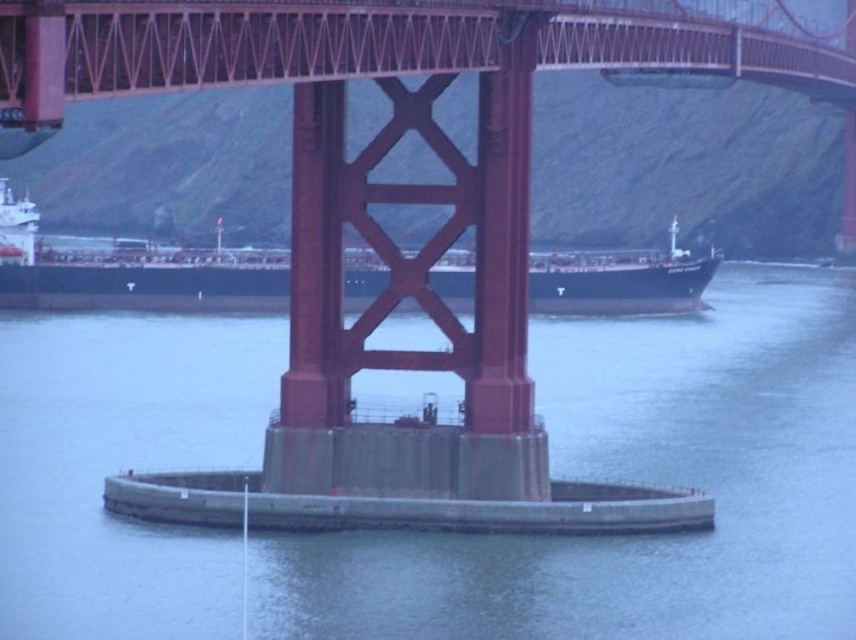
In the scene shown: You are standing on the circular platform at the bottom of the Golden Gate Bridge tower. You notice a point marked at coordinates (x=635, y=481). Based on the scene description, what is the location and appearance of the object at this point?

The point at coordinates (x=635, y=481) corresponds to gray concrete water at center, which is part of the base of the Golden Gate Bridge tower. It appears as a sturdy concrete structure in the water, reflecting the muted early morning or late afternoon light.

You are a drone operator trying to capture a photo of the Golden Gate Bridge. Your drone is currently at the gray concrete water at center. To ensure the bridge is fully visible in the photo, you need to adjust the drone to a higher altitude. Based on the scene description, what is the minimum altitude you should ascend to in order to frame the entire bridge in the photo?

The gray concrete water at center is located at point 2D coordinates of (635,481). To frame the entire bridge, the drone must ascend to an altitude that allows capturing the full structure from the base of the tower to the distant end of the bridge. However, without specific dimensional data, the exact altitude cannot be determined. The operator should ascend until the entire bridge is within the camera frame.

You are a photographer standing on the Golden Gate Bridge, looking down at the gray concrete water at center and the black matte ship at center. Which object is closer to you?

The gray concrete water at center is closer to the viewer than the black matte ship at center.